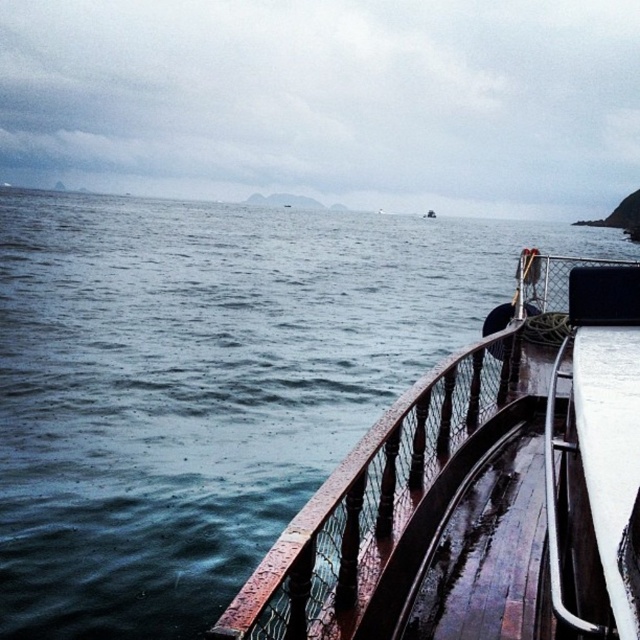
Question: Which point appears farthest from the camera in this image?

Choices:
 (A) (353, 515)
 (B) (8, 232)

Answer: (B)

Question: Which object appears closest to the camera in this image?

Choices:
 (A) dark blue water at left
 (B) rustic wood rail at lower right

Answer: (B)

Question: Is dark blue water at left thinner than rustic wood rail at lower right?

Choices:
 (A) yes
 (B) no

Answer: (B)

Question: Is dark blue water at left to the right of rustic wood rail at lower right from the viewer's perspective?

Choices:
 (A) yes
 (B) no

Answer: (A)

Question: Which of the following is the farthest from the observer?

Choices:
 (A) rustic wood rail at lower right
 (B) dark blue water at left

Answer: (B)

Question: Is dark blue water at left to the left of rustic wood rail at lower right from the viewer's perspective?

Choices:
 (A) yes
 (B) no

Answer: (B)